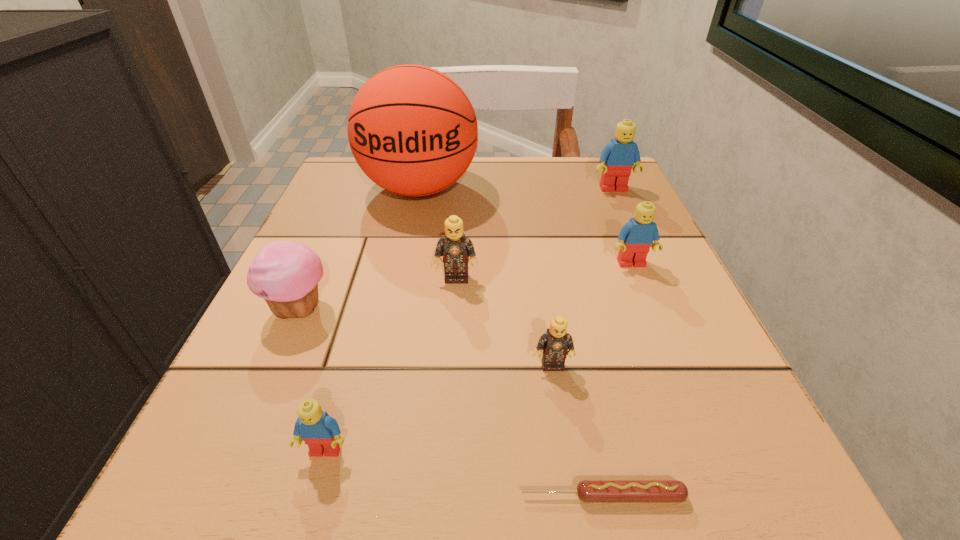
You are a GUI agent. You are given a task and a screenshot of the screen. Output one action in this format:
    pyautogui.click(x=<x>, y=<y>)
    Task: Click on the tallest object
    
    Given the screenshot: What is the action you would take?
    pyautogui.click(x=413, y=131)

Find the location of a particular element. This screenshot has height=540, width=960. the farthest blue Lego is located at coordinates (618, 157).

You are a GUI agent. You are given a task and a screenshot of the screen. Output one action in this format:
    pyautogui.click(x=<x>, y=<y>)
    Task: Click on the biggest blue Lego
    This screenshot has width=960, height=540.
    Given the screenshot: What is the action you would take?
    618,157

Locate an element on the screen. the second smallest blue Lego is located at coordinates (636, 237).

In order to click on the sixth nearest object in this screenshot , I will do `click(636, 237)`.

Where is `the third nearest Lego`? the third nearest Lego is located at coordinates (455, 248).

The width and height of the screenshot is (960, 540). What are the coordinates of `the fourth farthest object` in the screenshot? It's located at (455, 248).

At what (x,y) coordinates should I click in order to perform the action: click on the fourth nearest object. Please return your answer as a coordinate pair (x, y). Image resolution: width=960 pixels, height=540 pixels. Looking at the image, I should click on (285, 274).

This screenshot has height=540, width=960. I want to click on pink cupcake, so click(x=285, y=274).

Identify the location of the fourth farthest Lego. This screenshot has height=540, width=960. (556, 344).